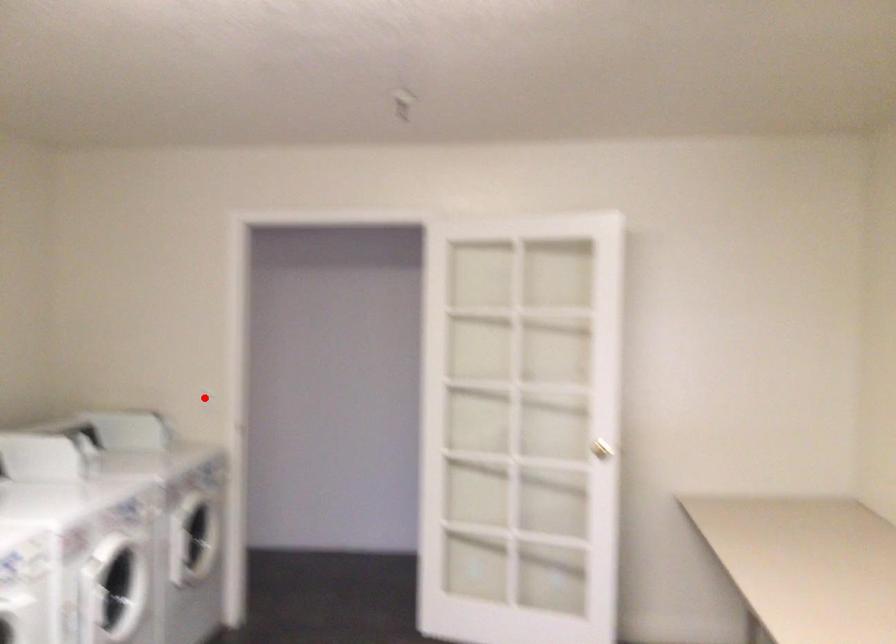
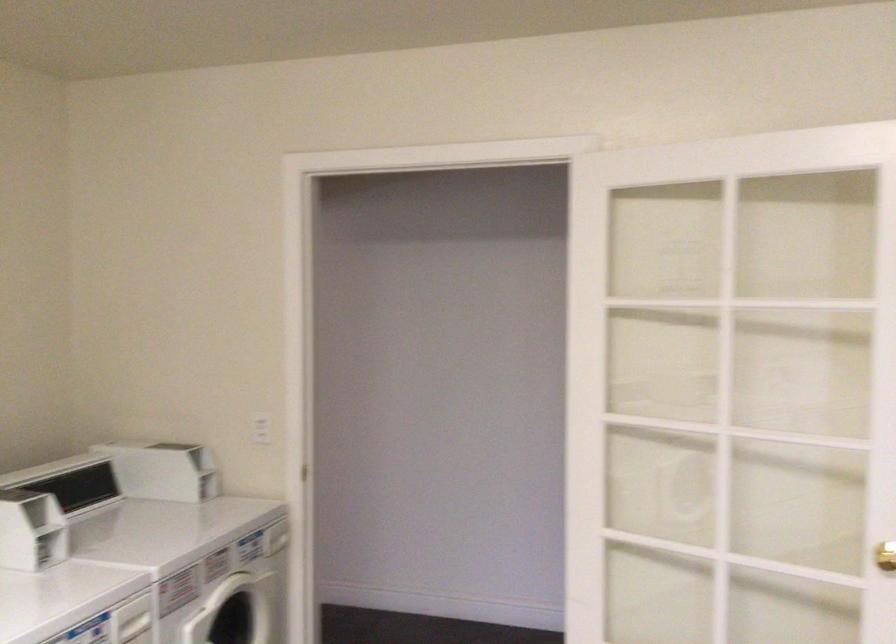
In the second image, find the point that corresponds to the highlighted location in the first image.

(261, 428)